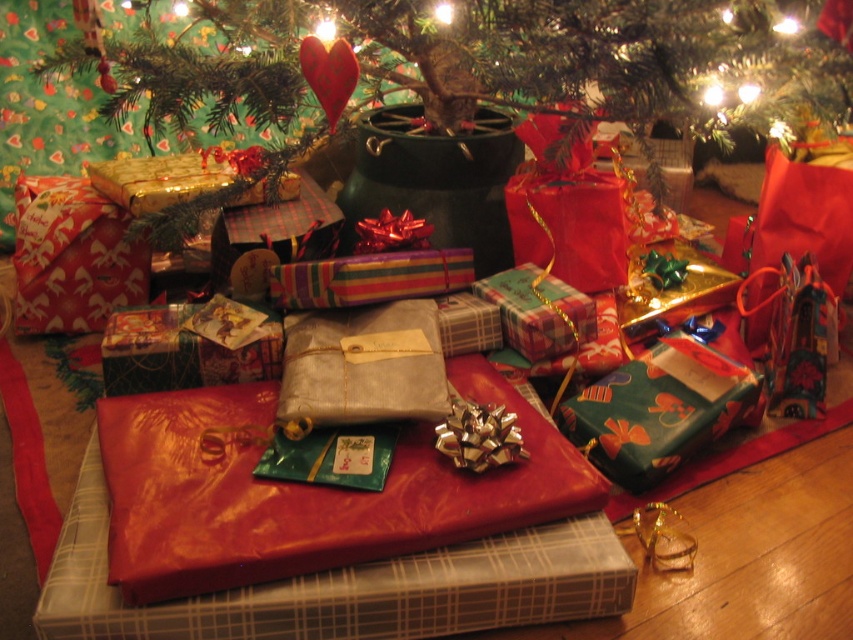
You are a delivery person who just arrived at the house and need to place a new gift that is 3 feet wide between the red shiny paper gift at left and the plaid paper gift at center. Can you fit it there?

The red shiny paper gift at left is 34.19 inches away from plaid paper gift at center. Since 34.19 inches is approximately 2.85 feet, the space between them is not wide enough to fit a gift that is 3 feet wide.

You are a guest at a Christmas party and want to find the tallest object in the room. Which one is taller between the green matte christmas tree at center and the red shiny paper gift at left?

The green matte christmas tree at center is much taller than the red shiny paper gift at left, so the tallest object is the green matte christmas tree at center.

You are a child who just arrived home and see the red shiny paper gift at left and the plaid paper gift at center under the Christmas tree. Which gift should you pick up first if you want to choose the one closer to you?

You should pick up the red shiny paper gift at left first because it is closer to you than the plaid paper gift at center.